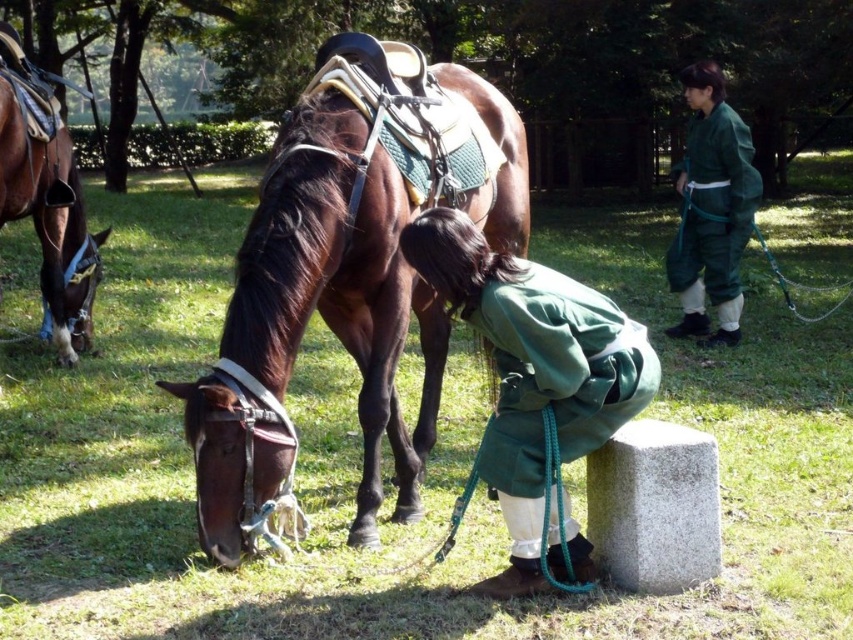
Can you confirm if green fabric kimono at upper right is thinner than brown leather saddle at left?

No.

Can you confirm if green fabric kimono at upper right is bigger than brown leather saddle at left?

Yes, green fabric kimono at upper right is bigger than brown leather saddle at left.

Who is more forward, [718,205] or [49,166]?

Positioned in front is point [49,166].

Image resolution: width=853 pixels, height=640 pixels. Find the location of `green fabric kimono at upper right`. green fabric kimono at upper right is located at coordinates (711, 209).

Consider the image. Who is more forward, (502,458) or (695,284)?

Point (502,458) is in front.

Does green soft robe at center appear under green fabric kimono at upper right?

Yes.

The height and width of the screenshot is (640, 853). What do you see at coordinates (535, 381) in the screenshot?
I see `green soft robe at center` at bounding box center [535, 381].

Identify the location of green soft robe at center. This screenshot has height=640, width=853. (535, 381).

Does shiny brown horse at center have a lesser width compared to brown leather saddle at left?

In fact, shiny brown horse at center might be wider than brown leather saddle at left.

Who is shorter, shiny brown horse at center or brown leather saddle at left?

Standing shorter between the two is brown leather saddle at left.

Which is behind, point (524, 182) or point (36, 200)?

Point (36, 200)

This screenshot has height=640, width=853. Identify the location of shiny brown horse at center. (306, 323).